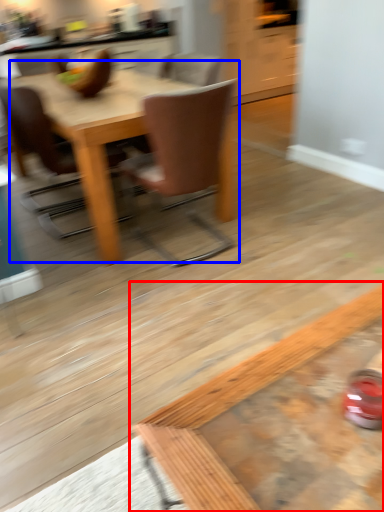
Question: Which of the following is the farthest to the observer, coffee table (highlighted by a red box) or kitchen & dining room table (highlighted by a blue box)?

Choices:
 (A) coffee table
 (B) kitchen & dining room table

Answer: (B)